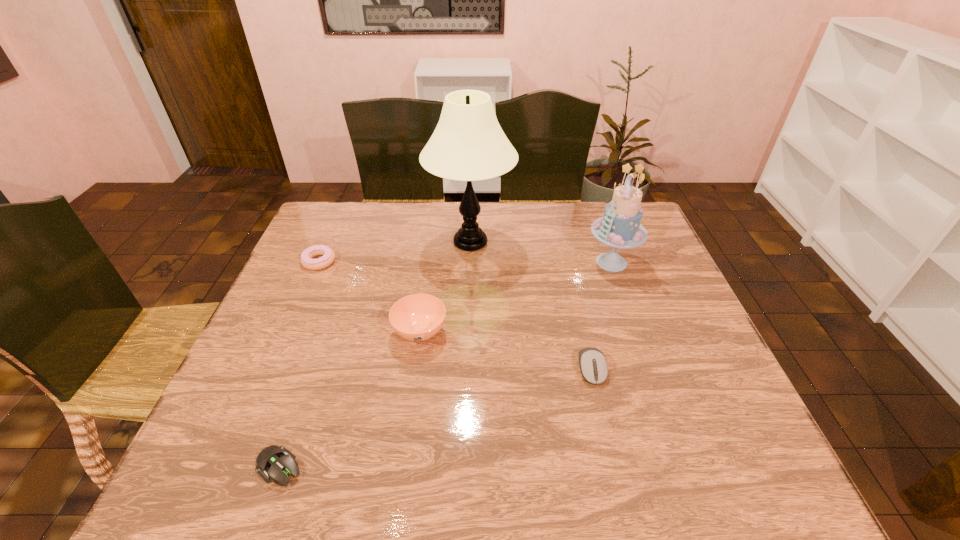
Identify the location of lamp. Image resolution: width=960 pixels, height=540 pixels. (468, 144).

The width and height of the screenshot is (960, 540). In order to click on cake in this screenshot , I will do `click(620, 227)`.

Find the location of a particular element. The image size is (960, 540). the second tallest object is located at coordinates (620, 227).

The width and height of the screenshot is (960, 540). I want to click on the fourth shortest object, so point(418,317).

Where is `the leftmost object`? the leftmost object is located at coordinates (328, 257).

I want to click on the farther computer mouse, so click(593, 365).

Identify the location of the right computer mouse. (593, 365).

Find the location of `the fifth object from right to left`. the fifth object from right to left is located at coordinates (275, 462).

Locate an element on the screen. This screenshot has height=540, width=960. the nearest object is located at coordinates (275, 462).

Locate an element on the screen. vacant space located on the right of the tallest object is located at coordinates (630, 242).